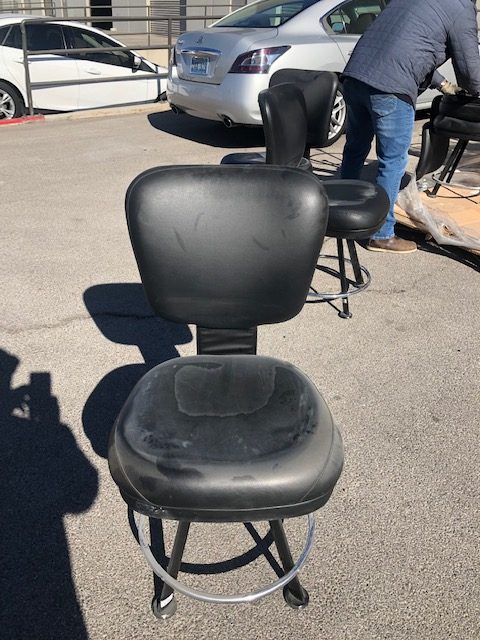
Locate an element on the screen. The height and width of the screenshot is (640, 480). front chair legs is located at coordinates (167, 596), (293, 589).